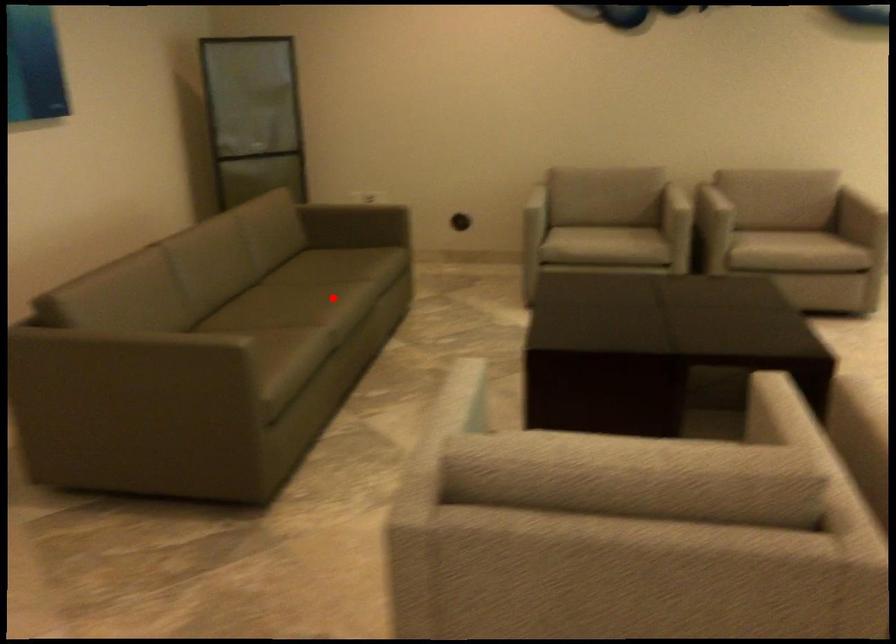
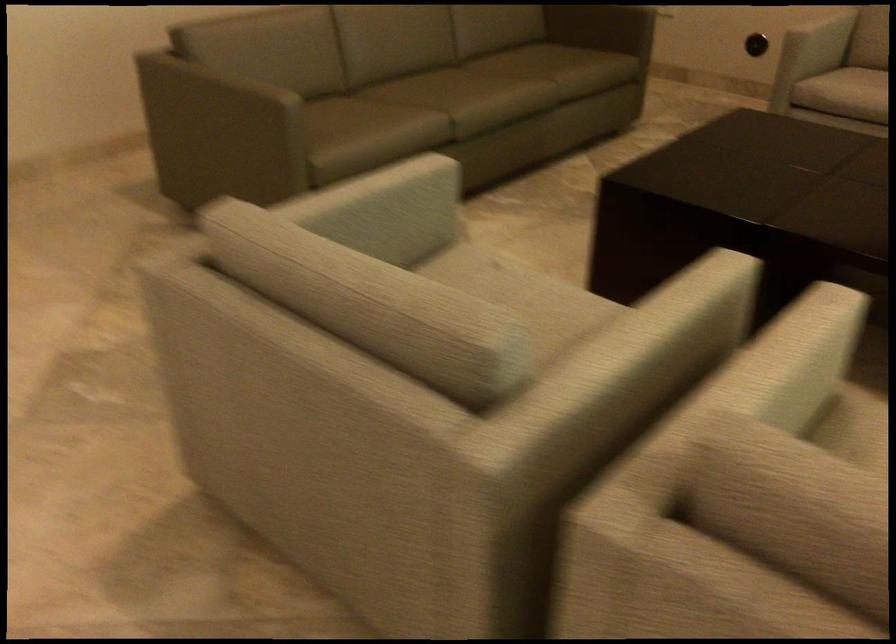
Where in the second image is the point corresponding to the highlighted location from the first image?

(472, 91)